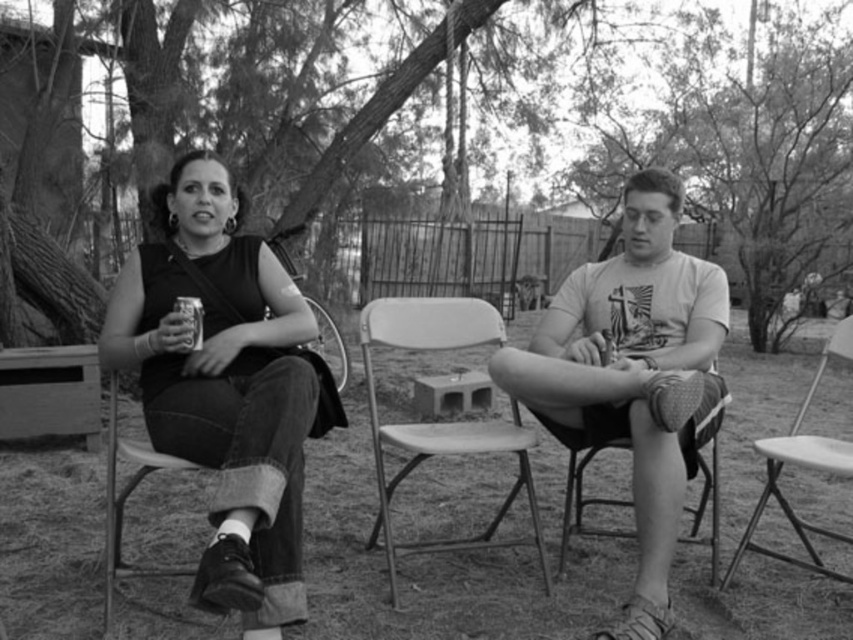
Is smooth bark tree trunk at upper left taller than metallic folding chair at right?

Yes, smooth bark tree trunk at upper left is taller than metallic folding chair at right.

Who is more forward, (322, 170) or (819, 465)?

Positioned in front is point (819, 465).

Is point (305, 193) in front of point (819, 529)?

No, it is behind (819, 529).

This screenshot has height=640, width=853. I want to click on smooth bark tree trunk at upper left, so tap(759, 145).

Between point (239, 573) and point (515, 378), which one is positioned behind?

The point (515, 378) is more distant.

Does matte black tank top at left appear under matte white t-shirt at center?

Actually, matte black tank top at left is above matte white t-shirt at center.

Who is more distant from viewer, (202, 273) or (648, 353)?

Point (648, 353)

Image resolution: width=853 pixels, height=640 pixels. In order to click on matte black tank top at left in this screenshot , I will do `click(225, 385)`.

Is matte white t-shirt at center bigger than smooth plastic chair at center?

No.

Who is shorter, matte white t-shirt at center or smooth plastic chair at center?

Standing shorter between the two is smooth plastic chair at center.

Is point (712, 360) more distant than point (381, 323)?

No, it is not.

Image resolution: width=853 pixels, height=640 pixels. Identify the location of matte white t-shirt at center. (633, 376).